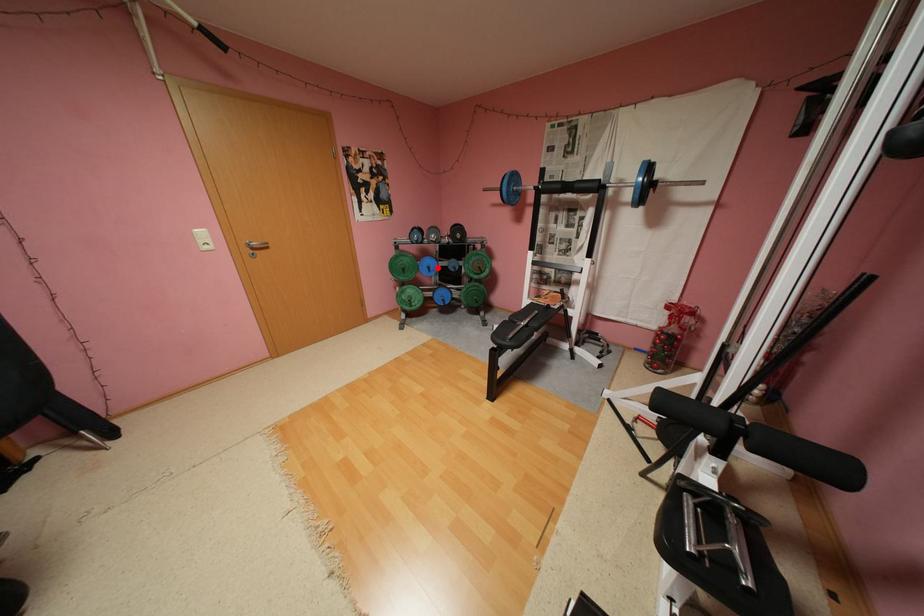
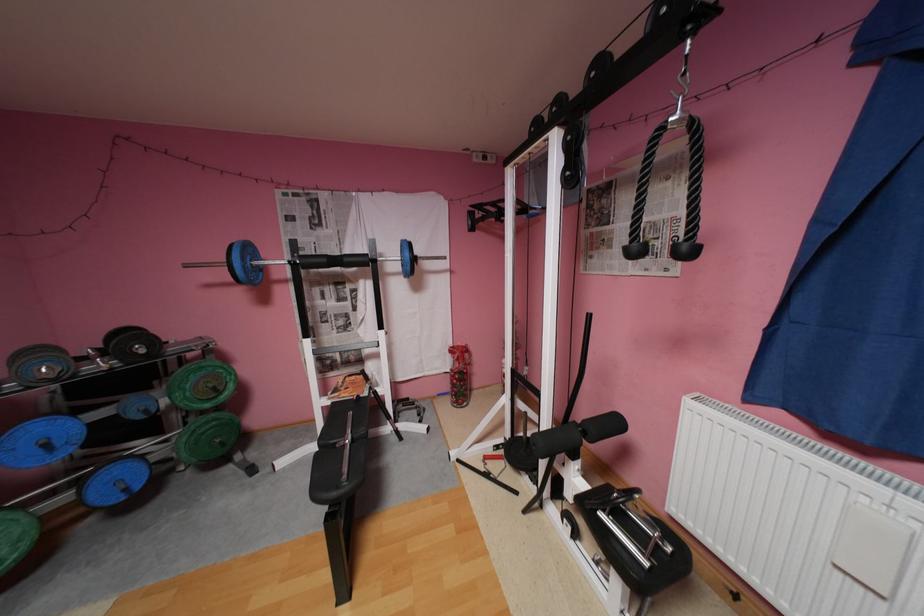
Question: I am providing you with two images of the same scene from different viewpoints. In image1, a red point is highlighted. Considering the same 3D point in image2, which of the following is correct?

Choices:
 (A) It is closer
 (B) It is farther

Answer: (B)